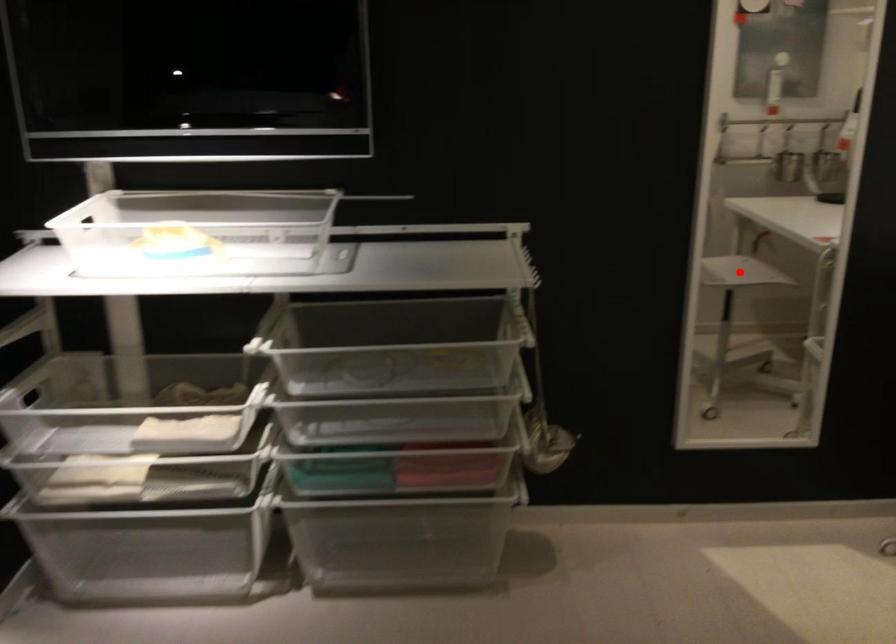
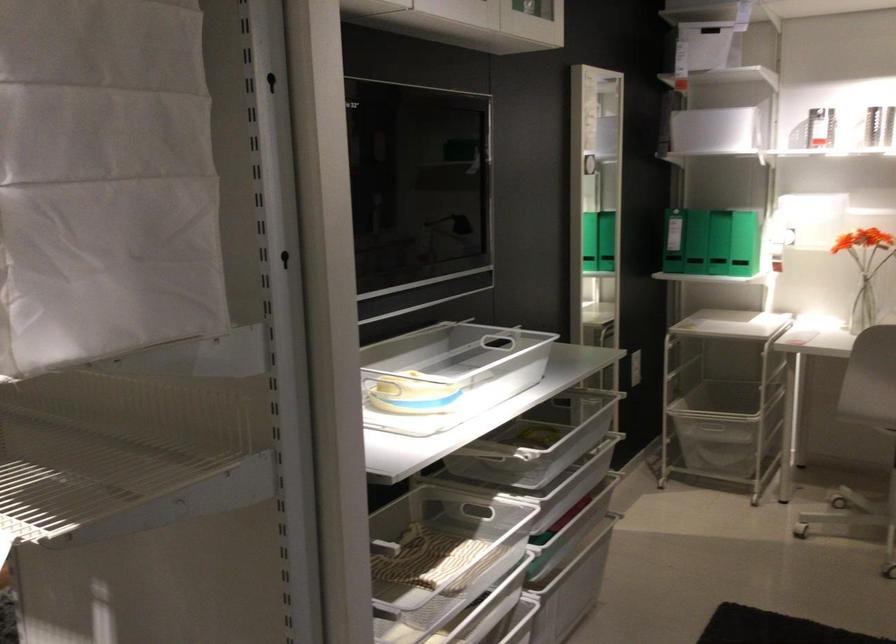
Question: I am providing you with two images of the same scene from different viewpoints. A red point is marked on the first image. Is the red point's position out of view in image 2?

Choices:
 (A) Yes
 (B) No

Answer: (A)